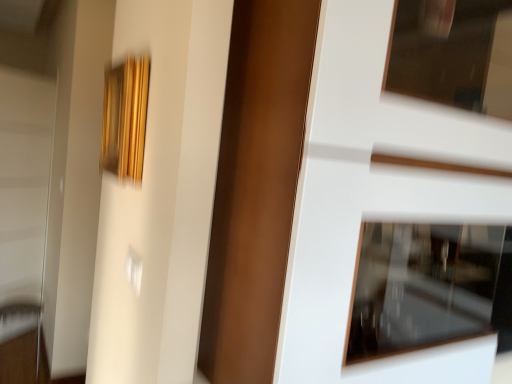
Question: From a real-world perspective, is white glossy door at center above or below metallic silver door handle at lower left?

Choices:
 (A) below
 (B) above

Answer: (B)

Question: From the image's perspective, is white glossy door at center above or below metallic silver door handle at lower left?

Choices:
 (A) above
 (B) below

Answer: (A)

Question: Which object is positioned farthest from the metallic silver door handle at lower left?

Choices:
 (A) white glossy screen door at left
 (B) white glossy door at center
 (C) gold textured frame at upper left

Answer: (B)

Question: Which object is positioned farthest from the gold textured frame at upper left?

Choices:
 (A) white glossy screen door at left
 (B) metallic silver door handle at lower left
 (C) white glossy door at center

Answer: (A)